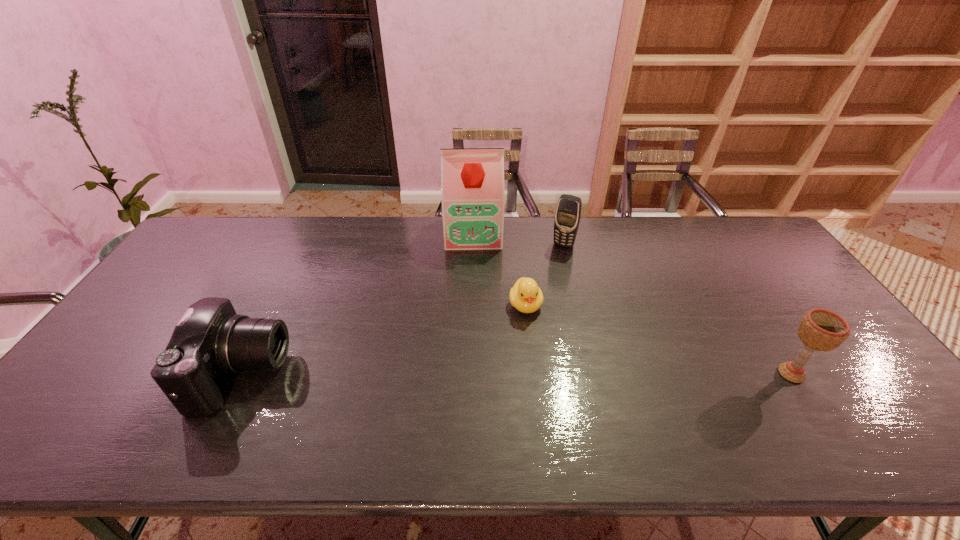
Where is `free space on the desktop that is between the leftmost object and the chalice and is positioned on the beak of the third object from right to left`? The width and height of the screenshot is (960, 540). free space on the desktop that is between the leftmost object and the chalice and is positioned on the beak of the third object from right to left is located at coordinates (540, 374).

At what (x,y) coordinates should I click in order to perform the action: click on vacant space on the desktop that is between the camera and the rightmost object and is positioned on the front face of the cellular telephone. Please return your answer as a coordinate pair (x, y). This screenshot has height=540, width=960. Looking at the image, I should click on (500, 374).

You are a GUI agent. You are given a task and a screenshot of the screen. Output one action in this format:
    pyautogui.click(x=<x>, y=<y>)
    Task: Click on the vacant space on the desktop that is between the camera and the chalice and is positioned with the cap open on the tallest object
    
    Given the screenshot: What is the action you would take?
    pyautogui.click(x=477, y=374)